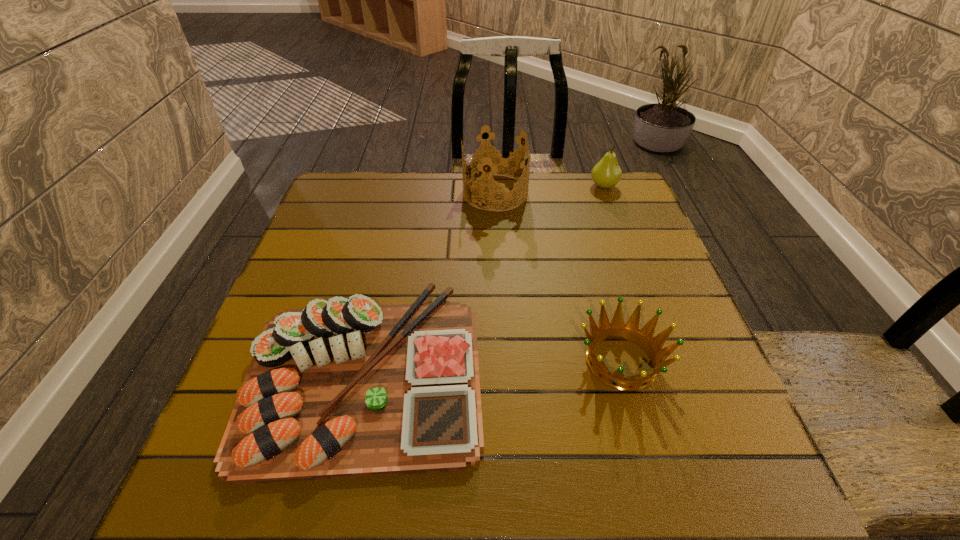
Locate an element on the screen. The height and width of the screenshot is (540, 960). vacant space that is in between the tallest object and the shorter crown is located at coordinates (559, 276).

Locate an element on the screen. The width and height of the screenshot is (960, 540). vacant space that's between the platter and the left crown is located at coordinates (430, 281).

You are a GUI agent. You are given a task and a screenshot of the screen. Output one action in this format:
    pyautogui.click(x=<x>, y=<y>)
    Task: Click on the object that ranks as the second closest to the farther crown
    
    Given the screenshot: What is the action you would take?
    pyautogui.click(x=344, y=388)

At what (x,y) coordinates should I click in order to perform the action: click on object that stands as the third closest to the pear. Please return your answer as a coordinate pair (x, y). Looking at the image, I should click on (344, 388).

I want to click on free space that satisfies the following two spatial constraints: 1. on the back side of the platter; 2. on the right side of the pear, so click(x=405, y=186).